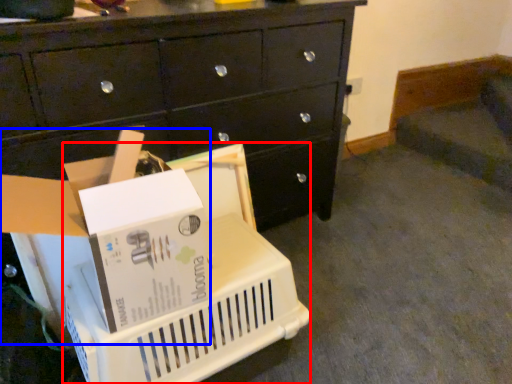
Question: Which point is closer to the camera, basket (highlighted by a red box) or storage box (highlighted by a blue box)?

Choices:
 (A) basket
 (B) storage box

Answer: (B)